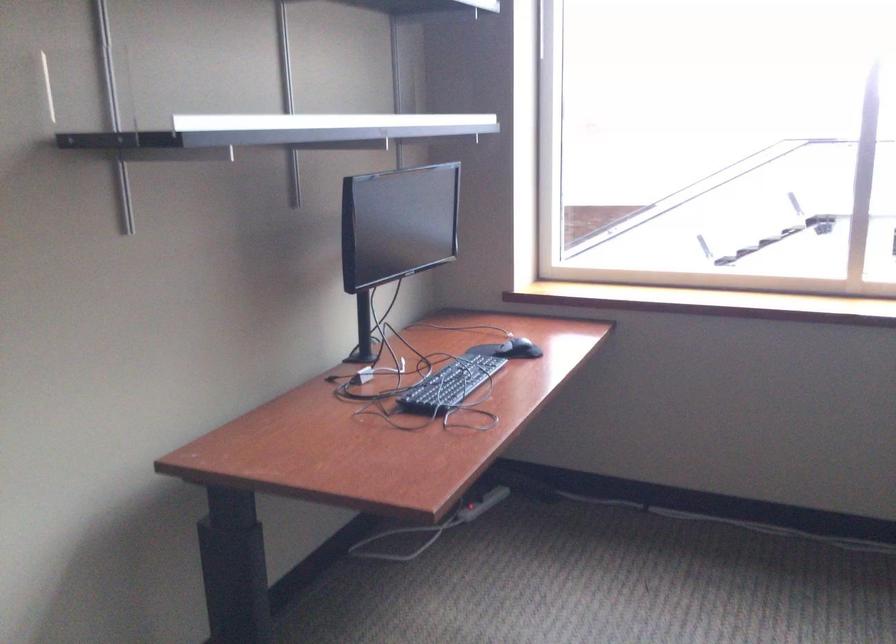
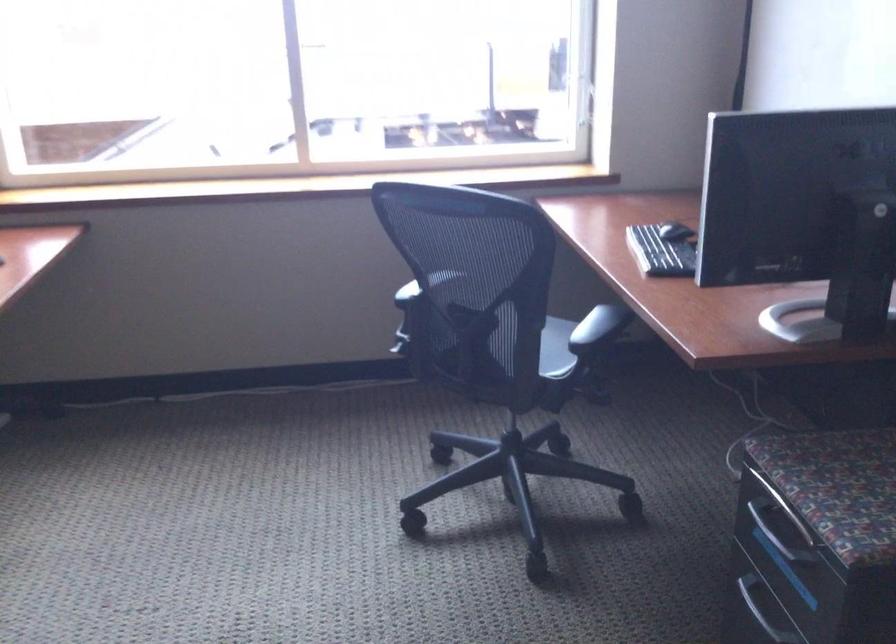
Which direction would the cameraman need to move to produce the second image?

The cameraman walked toward right, backward.